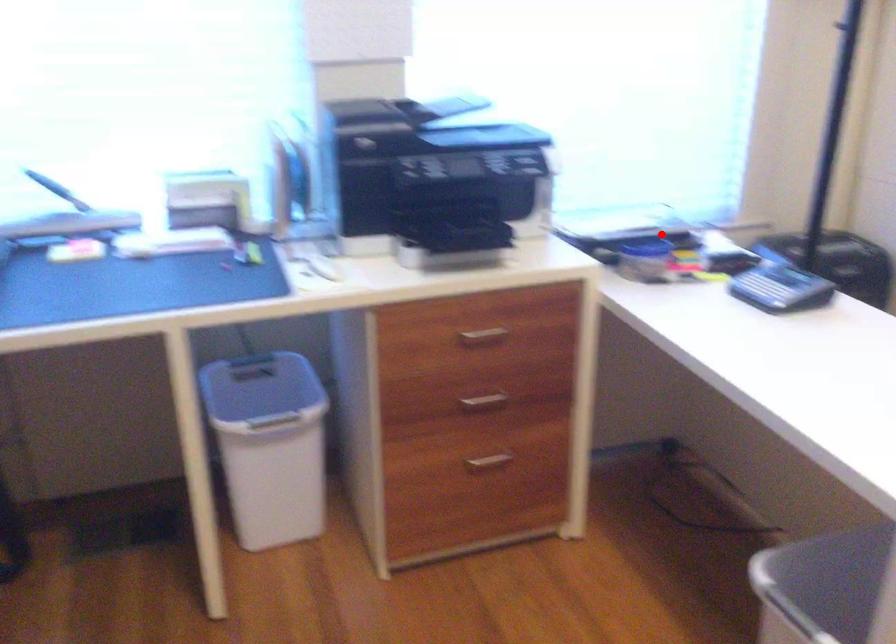
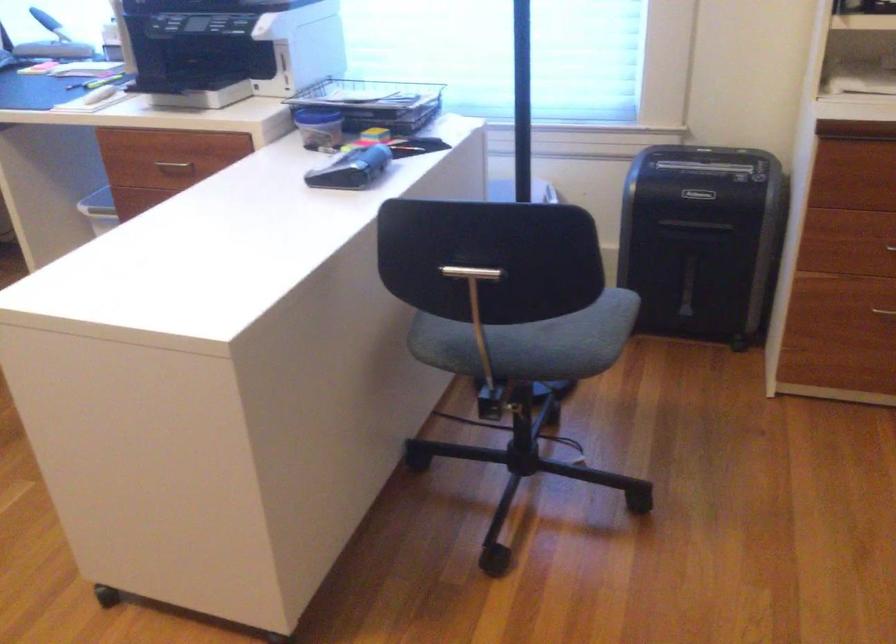
In the second image, find the point that corresponds to the highlighted location in the first image.

(374, 102)